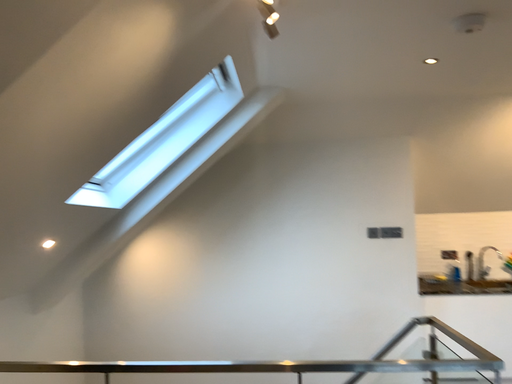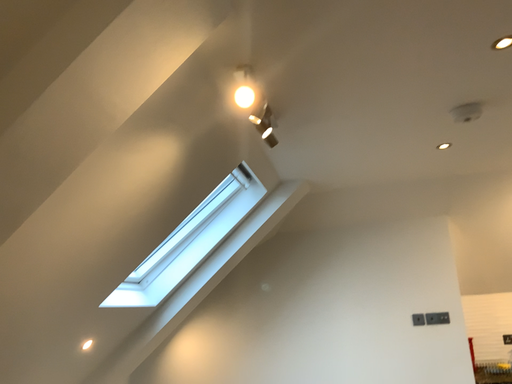
Question: How did the camera likely rotate when shooting the video?

Choices:
 (A) rotated downward
 (B) rotated upward

Answer: (B)